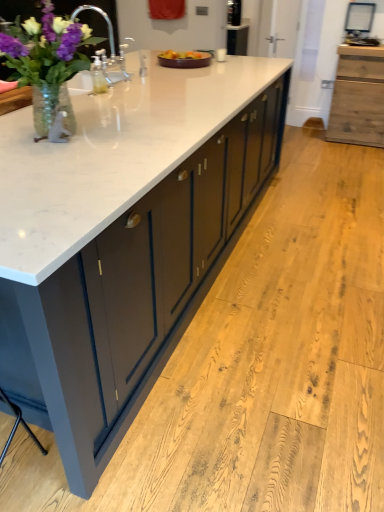
At what (x,y) coordinates should I click in order to perform the action: click on vacant region above brown ceramic tray at center (from a real-world perspective). Please return your answer as a coordinate pair (x, y). Looking at the image, I should click on point(184,55).